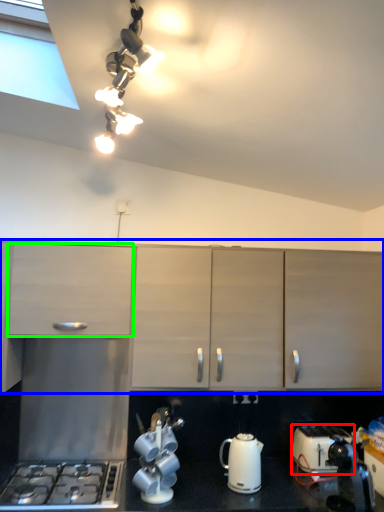
Question: Considering the real-world distances, which object is closest to toaster (highlighted by a red box)? cabinetry (highlighted by a blue box) or cabinetry (highlighted by a green box).

Choices:
 (A) cabinetry
 (B) cabinetry

Answer: (A)